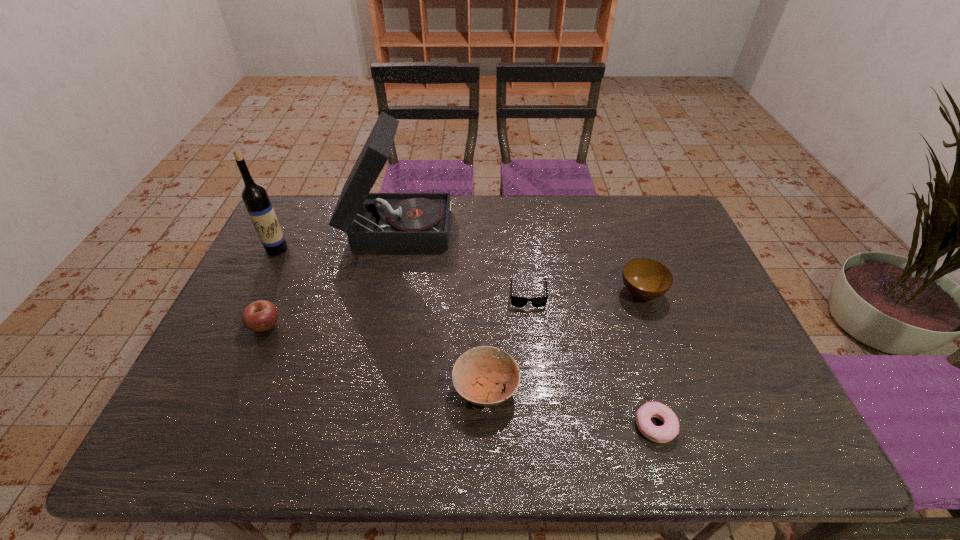
What are the coordinates of `vacant space located 0.300m on the side of the apple with the unique marking` in the screenshot? It's located at (211, 451).

The width and height of the screenshot is (960, 540). Find the location of `vacant point located 0.100m on the left of the nearer bowl`. vacant point located 0.100m on the left of the nearer bowl is located at coordinates (411, 389).

I want to click on free space located 0.260m on the front-facing side of the second shortest object, so click(539, 392).

Identify the location of blank space located 0.310m on the left of the doughnut. (496, 426).

At what (x,y) coordinates should I click in order to perform the action: click on object positioned at the far edge. Please return your answer as a coordinate pair (x, y). Image resolution: width=960 pixels, height=540 pixels. Looking at the image, I should click on (373, 221).

What are the coordinates of `object that is at the near edge` in the screenshot? It's located at (660, 434).

Identify the location of wine bottle at the left edge. (260, 210).

At what (x,y) coordinates should I click in order to perform the action: click on apple that is at the left edge. Please return your answer as a coordinate pair (x, y). The height and width of the screenshot is (540, 960). Looking at the image, I should click on (259, 316).

The width and height of the screenshot is (960, 540). Identify the location of object present at the right edge. (646, 279).

This screenshot has height=540, width=960. I want to click on vacant space at the far edge, so click(x=597, y=197).